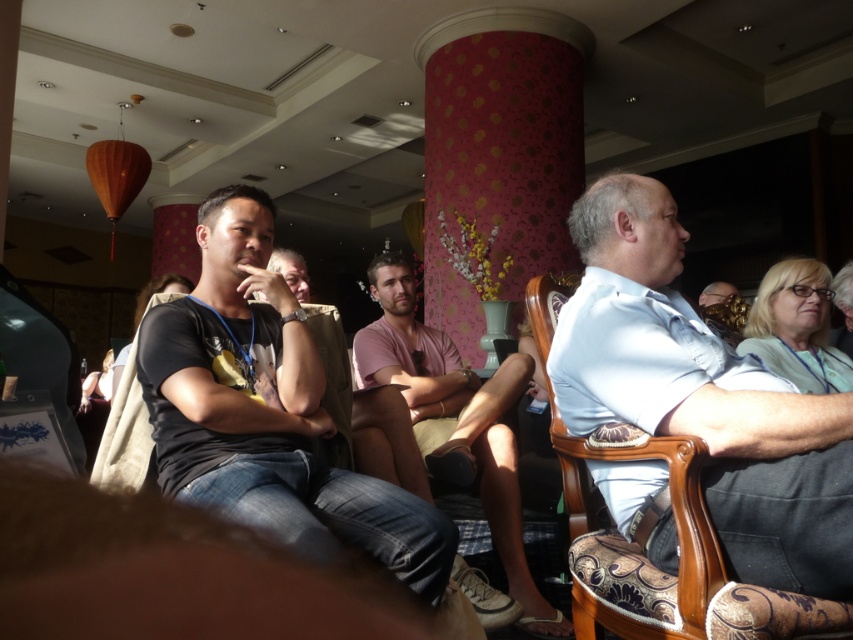
Question: Is light blue denim shirt at center further to the viewer compared to black cotton t-shirt at center?

Choices:
 (A) no
 (B) yes

Answer: (B)

Question: Is light blue denim shirt at center bigger than pink cotton shirt at center?

Choices:
 (A) no
 (B) yes

Answer: (A)

Question: Can you confirm if denim jeans at lower left is positioned below light blue shirt at center?

Choices:
 (A) no
 (B) yes

Answer: (B)

Question: Which object appears farthest from the camera in this image?

Choices:
 (A) light blue shirt at center
 (B) denim jeans at lower left
 (C) matte black shirt at center

Answer: (A)

Question: Considering the real-world distances, which object is closest to the matte black shirt at center?

Choices:
 (A) light blue denim shirt at center
 (B) light blue shirt at center

Answer: (A)

Question: Among these objects, which one is farthest from the camera?

Choices:
 (A) pink cotton shirt at center
 (B) black cotton t-shirt at center
 (C) matte black shirt at center
 (D) light blue shirt at center

Answer: (D)